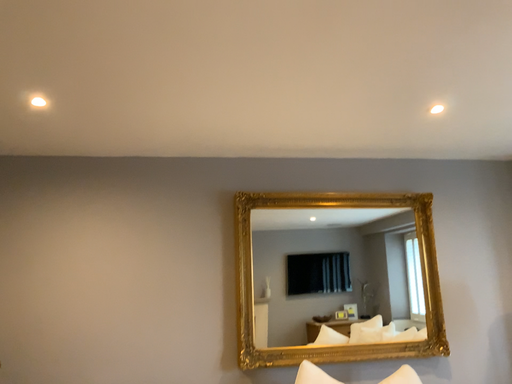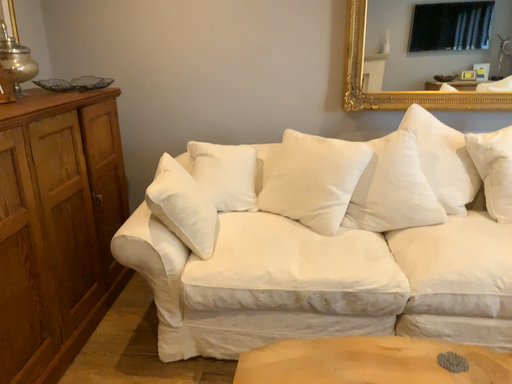
Question: How did the camera likely rotate when shooting the video?

Choices:
 (A) rotated right
 (B) rotated left

Answer: (B)